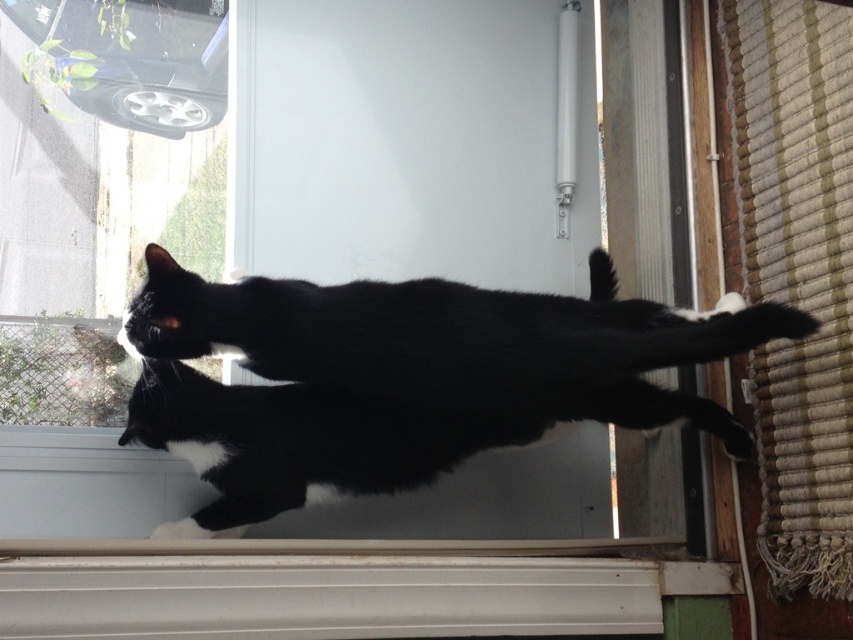
Which of these two, transparent glass screen door at center or black fur cat at center, stands taller?

transparent glass screen door at center

Does transparent glass screen door at center come behind black fur cat at center?

That is True.

Locate an element on the screen. This screenshot has height=640, width=853. transparent glass screen door at center is located at coordinates (405, 141).

Where is `transparent glass screen door at center`? The image size is (853, 640). transparent glass screen door at center is located at coordinates (405, 141).